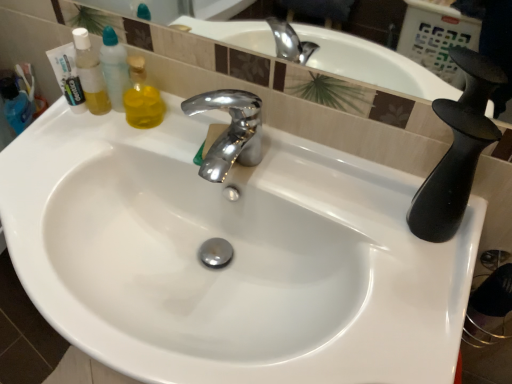
At what (x,y) coordinates should I click in order to perform the action: click on white glossy sink at center. Please return your answer as a coordinate pair (x, y). The height and width of the screenshot is (384, 512). Looking at the image, I should click on (233, 258).

Describe the element at coordinates (233, 258) in the screenshot. I see `white glossy sink at center` at that location.

What do you see at coordinates (90, 74) in the screenshot? I see `translucent plastic mouthwash at left` at bounding box center [90, 74].

You are a GUI agent. You are given a task and a screenshot of the screen. Output one action in this format:
    pyautogui.click(x=<x>, y=<y>)
    Task: Click on the translucent plastic mouthwash at left
    The width and height of the screenshot is (512, 384).
    Given the screenshot: What is the action you would take?
    pyautogui.click(x=90, y=74)

Measure the distance between point (245, 107) and camera.

Point (245, 107) is 30.43 inches away from camera.

The image size is (512, 384). What are the coordinates of `white glossy sink at center` in the screenshot? It's located at (233, 258).

From the image's perspective, is translucent plastic mouthwash at left over white glossy sink at center?

Yes, from the image's perspective, translucent plastic mouthwash at left is on top of white glossy sink at center.

Is translucent plastic mouthwash at left touching white glossy sink at center?

→ translucent plastic mouthwash at left is not next to white glossy sink at center, and they're not touching.

How different are the orientations of translucent plastic mouthwash at left and white glossy sink at center in degrees?

5.51e-05 degrees.

Considering the relative sizes of translucent plastic mouthwash at left and white glossy sink at center in the image provided, is translucent plastic mouthwash at left bigger than white glossy sink at center?

Actually, translucent plastic mouthwash at left might be smaller than white glossy sink at center.

Consider the image. Measure the distance between polished chrome faucet at center and white glossy sink at center.

polished chrome faucet at center is 20.02 centimeters from white glossy sink at center.

Are polished chrome faucet at center and white glossy sink at center making contact?

polished chrome faucet at center and white glossy sink at center are not in contact.

Does point (234, 108) lie in front of point (313, 172)?

No, it is behind (313, 172).

Which object is wider, polished chrome faucet at center or white glossy sink at center?

With larger width is white glossy sink at center.

The height and width of the screenshot is (384, 512). I want to click on mouthwash that appears above the polished chrome faucet at center (from the image's perspective), so click(x=90, y=74).

Consider the image. How many degrees apart are the facing directions of polished chrome faucet at center and translucent plastic mouthwash at left?

7.78e-05 degrees.

Can you confirm if polished chrome faucet at center is smaller than translucent plastic mouthwash at left?

Yes, polished chrome faucet at center is smaller than translucent plastic mouthwash at left.

Is polished chrome faucet at center positioned behind translucent plastic mouthwash at left?

Yes, it is.

Based on the photo, considering the sizes of objects white glossy sink at center and translucent plastic mouthwash at left in the image provided, who is taller, white glossy sink at center or translucent plastic mouthwash at left?

With more height is white glossy sink at center.

Considering the positions of objects white glossy sink at center and translucent plastic mouthwash at left in the image provided, who is more to the left, white glossy sink at center or translucent plastic mouthwash at left?

Positioned to the left is translucent plastic mouthwash at left.

From the image's perspective, who appears lower, white glossy sink at center or translucent plastic mouthwash at left?

white glossy sink at center appears lower in the image.

Can you confirm if white glossy sink at center is thinner than translucent plastic mouthwash at left?

In fact, white glossy sink at center might be wider than translucent plastic mouthwash at left.

From a real-world perspective, does translucent plastic mouthwash at left sit lower than polished chrome faucet at center?

Actually, translucent plastic mouthwash at left is physically above polished chrome faucet at center in the real world.

Consider the image. In terms of size, does translucent plastic mouthwash at left appear bigger or smaller than polished chrome faucet at center?

Considering their sizes, translucent plastic mouthwash at left takes up more space than polished chrome faucet at center.

Is translucent plastic mouthwash at left inside or outside of polished chrome faucet at center?

translucent plastic mouthwash at left is located beyond the bounds of polished chrome faucet at center.

From a real-world perspective, who is located lower, white glossy sink at center or polished chrome faucet at center?

From a 3D spatial view, white glossy sink at center is below.

Is there a large distance between white glossy sink at center and polished chrome faucet at center?

white glossy sink at center is actually quite close to polished chrome faucet at center.

Locate an element on the screen. sink located on the left of polished chrome faucet at center is located at coordinates (233, 258).

Is white glossy sink at center inside or outside of polished chrome faucet at center?

white glossy sink at center lies outside polished chrome faucet at center.

Locate an element on the screen. sink below the translucent plastic mouthwash at left (from the image's perspective) is located at coordinates [x=233, y=258].

Identify the location of tap located on the right of white glossy sink at center. (230, 131).

Based on their spatial positions, is polished chrome faucet at center or white glossy sink at center further from translucent plastic mouthwash at left?

The object further to translucent plastic mouthwash at left is white glossy sink at center.

Considering their positions, is white glossy sink at center positioned further to translucent plastic mouthwash at left than polished chrome faucet at center?

white glossy sink at center lies further to translucent plastic mouthwash at left than the other object.

From the image, which object appears to be farther from polished chrome faucet at center, white glossy sink at center or translucent plastic mouthwash at left?

A: translucent plastic mouthwash at left.

Which object lies further to the anchor point white glossy sink at center, translucent plastic mouthwash at left or polished chrome faucet at center?

translucent plastic mouthwash at left lies further to white glossy sink at center than the other object.

In the scene shown: Estimate the real-world distances between objects in this image. Which object is closer to polished chrome faucet at center, translucent plastic mouthwash at left or white glossy sink at center?

white glossy sink at center.

When comparing their distances from white glossy sink at center, does polished chrome faucet at center or translucent plastic mouthwash at left seem further?

Among the two, translucent plastic mouthwash at left is located further to white glossy sink at center.

Locate an element on the screen. mouthwash between white glossy sink at center and polished chrome faucet at center from front to back is located at coordinates (90, 74).